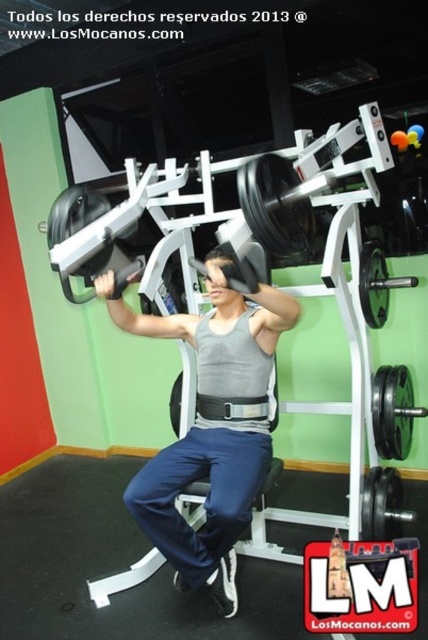
Which is below, gray matte tank top at center or black rubber barbell at center?

Positioned lower is gray matte tank top at center.

Who is positioned more to the left, gray matte tank top at center or black rubber barbell at center?

gray matte tank top at center

Between point (143, 522) and point (172, 410), which one is positioned behind?

The point (172, 410) is behind.

Locate an element on the screen. gray matte tank top at center is located at coordinates (211, 428).